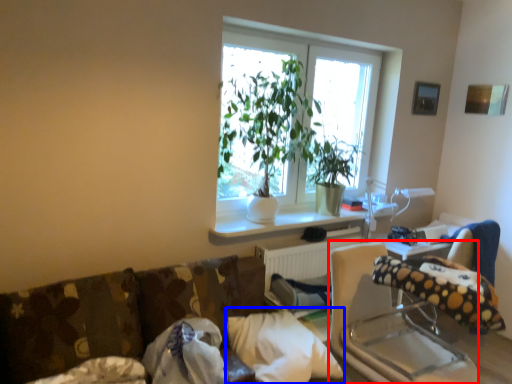
Question: Which object is further to the camera taking this photo, rocking chair (highlighted by a red box) or pillow (highlighted by a blue box)?

Choices:
 (A) rocking chair
 (B) pillow

Answer: (B)